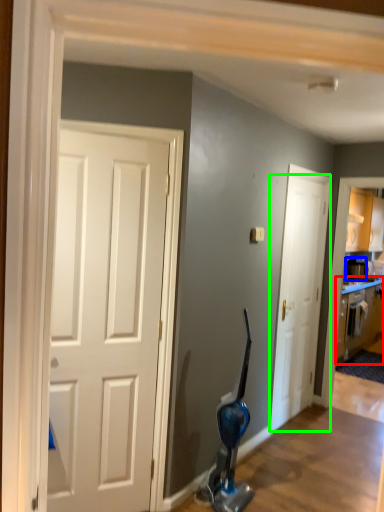
Question: Which is farther away from cabinetry (highlighted by a red box)? appliance (highlighted by a blue box) or door (highlighted by a green box)?

Choices:
 (A) appliance
 (B) door

Answer: (B)